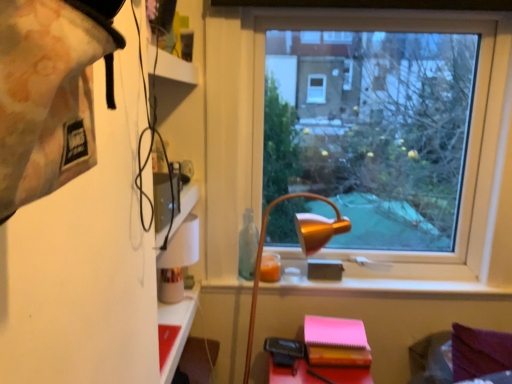
Question: Is point (195, 307) closer or farther from the camera than point (458, 137)?

Choices:
 (A) farther
 (B) closer

Answer: (B)

Question: Choose the correct answer: Is matte red table at lower left inside transparent glass window at center or outside it?

Choices:
 (A) inside
 (B) outside

Answer: (B)

Question: Estimate the real-world distances between objects in this image. Which object is farther from the gold metallic lamp at center?

Choices:
 (A) matte red table at lower left
 (B) transparent glass window at center
 (C) pink matte notebook at lower right

Answer: (B)

Question: Estimate the real-world distances between objects in this image. Which object is farther from the transparent glass window at center?

Choices:
 (A) gold metallic lamp at center
 (B) pink matte notebook at lower right
 (C) matte red table at lower left

Answer: (C)